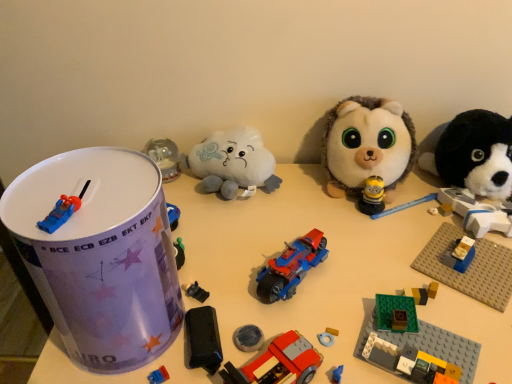
What are the coordinates of `vacant space in front of white plush cloud at center, which is the third toy in left-to-right order` in the screenshot? It's located at (224, 235).